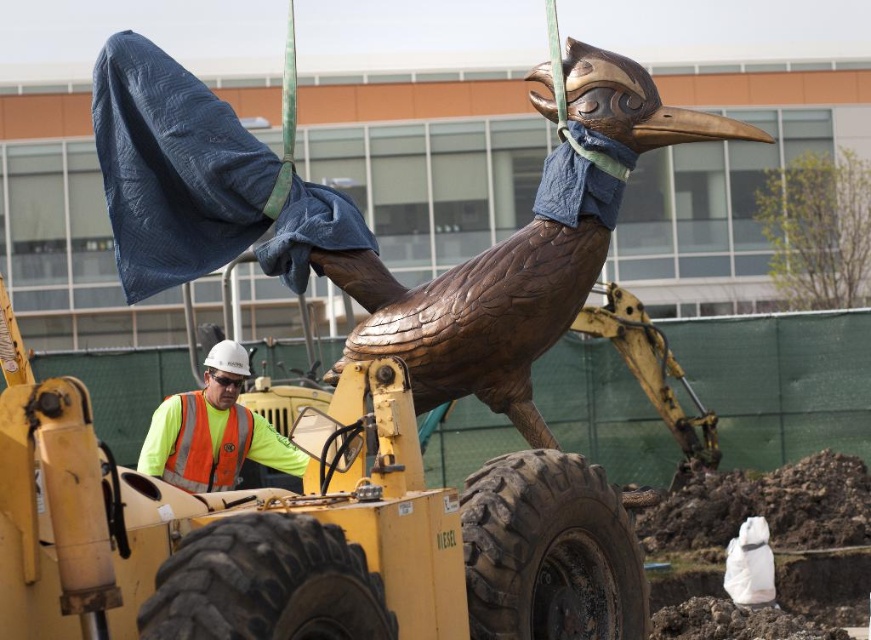
Is dark brown rubber tire at lower center positioned in front of neon yellow reflective vest at center?

Yes, it is in front of neon yellow reflective vest at center.

Is point (611, 506) positioned behind point (200, 468)?

No, it is not.

Image resolution: width=871 pixels, height=640 pixels. In order to click on dark brown rubber tire at lower center in this screenshot , I will do `click(549, 552)`.

From the picture: Can you confirm if bronze sculpture at center is wider than reflective orange safety vest at center?

Correct, the width of bronze sculpture at center exceeds that of reflective orange safety vest at center.

Can you confirm if bronze sculpture at center is shorter than reflective orange safety vest at center?

No.

Does point (208, 180) lie behind point (241, 436)?

No, it is not.

I want to click on bronze sculpture at center, so click(x=369, y=230).

Can you confirm if bronze sculpture at center is taller than black rubber tire at lower center?

Indeed, bronze sculpture at center has a greater height compared to black rubber tire at lower center.

Can you confirm if bronze sculpture at center is shorter than black rubber tire at lower center?

No, bronze sculpture at center is not shorter than black rubber tire at lower center.

Find the location of a particular element. The width and height of the screenshot is (871, 640). bronze sculpture at center is located at coordinates (369, 230).